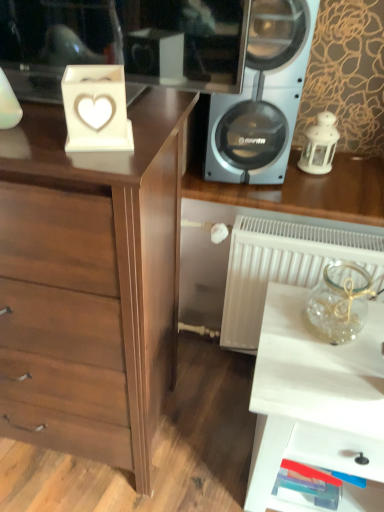
Question: Could you tell me if brown wood chest of drawers at left is facing white porcelain lantern at right?

Choices:
 (A) no
 (B) yes

Answer: (A)

Question: From the image's perspective, is brown wood chest of drawers at left beneath white porcelain lantern at right?

Choices:
 (A) yes
 (B) no

Answer: (A)

Question: Can you confirm if brown wood chest of drawers at left is thinner than white porcelain lantern at right?

Choices:
 (A) no
 (B) yes

Answer: (A)

Question: Can you confirm if brown wood chest of drawers at left is bigger than white porcelain lantern at right?

Choices:
 (A) yes
 (B) no

Answer: (A)

Question: Considering the relative positions of brown wood chest of drawers at left and white porcelain lantern at right in the image provided, is brown wood chest of drawers at left behind white porcelain lantern at right?

Choices:
 (A) yes
 (B) no

Answer: (B)

Question: Can you confirm if brown wood chest of drawers at left is taller than white porcelain lantern at right?

Choices:
 (A) yes
 (B) no

Answer: (A)

Question: Is silver metallic speaker at upper right beside clear glass jar at right?

Choices:
 (A) yes
 (B) no

Answer: (B)

Question: Is silver metallic speaker at upper right taller than clear glass jar at right?

Choices:
 (A) no
 (B) yes

Answer: (B)

Question: Is silver metallic speaker at upper right positioned with its back to clear glass jar at right?

Choices:
 (A) yes
 (B) no

Answer: (B)

Question: Could you tell me if silver metallic speaker at upper right is turned towards clear glass jar at right?

Choices:
 (A) yes
 (B) no

Answer: (A)

Question: Would you consider silver metallic speaker at upper right to be distant from clear glass jar at right?

Choices:
 (A) yes
 (B) no

Answer: (B)

Question: Can you confirm if silver metallic speaker at upper right is bigger than clear glass jar at right?

Choices:
 (A) yes
 (B) no

Answer: (A)

Question: From a real-world perspective, does white glossy table at lower right stand above silver metallic speaker at upper right?

Choices:
 (A) yes
 (B) no

Answer: (B)